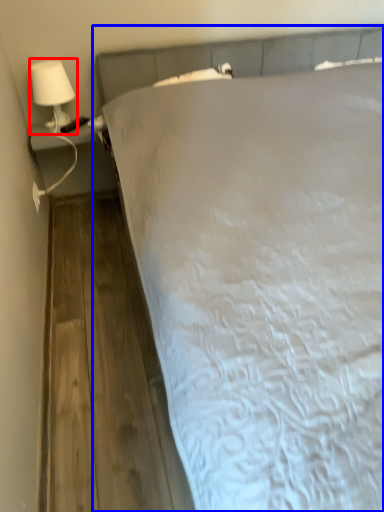
Question: Which object appears farthest to the camera in this image, lamp (highlighted by a red box) or bed (highlighted by a blue box)?

Choices:
 (A) lamp
 (B) bed

Answer: (A)